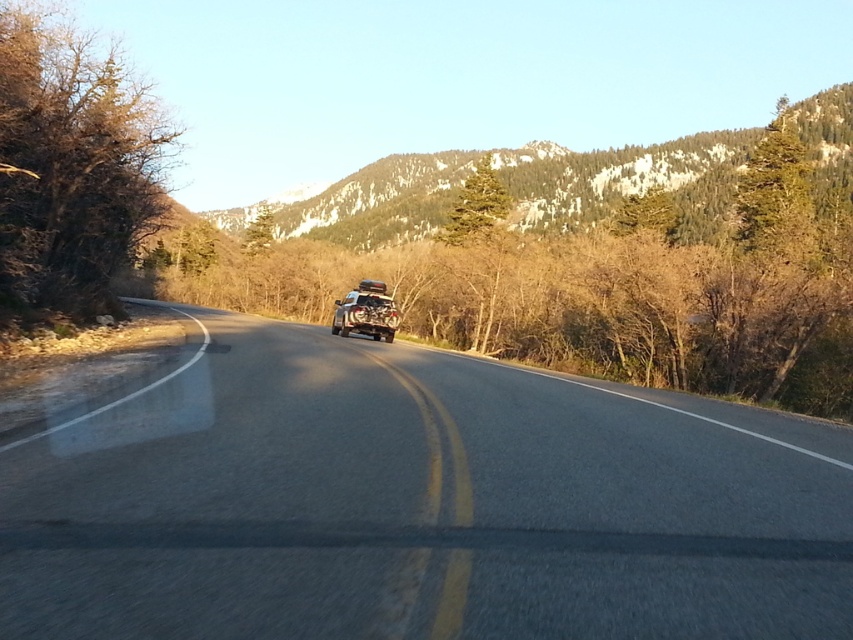
Who is higher up, asphalt road at center or green textured mountain at upper center?

green textured mountain at upper center is above.

Measure the distance between asphalt road at center and camera.

11.46 feet

Find the location of a particular element. asphalt road at center is located at coordinates (405, 499).

Between green textured mountain at upper center and metallic silver jeep at center, which one has less height?

With less height is metallic silver jeep at center.

Does point (519, 220) lie in front of point (397, 321)?

No.

Identify the location of green textured mountain at upper center. (525, 189).

Between point (677, 595) and point (389, 339), which one is positioned in front?

Point (677, 595)

Is asphalt road at center behind metallic silver jeep at center?

That is False.

Identify the location of asphalt road at center. (405, 499).

Identify the location of asphalt road at center. (405, 499).